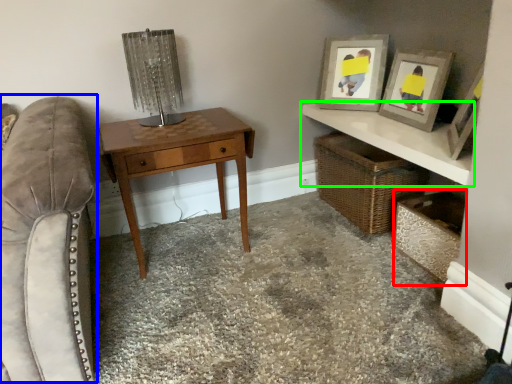
Question: Which is farther away from shelf (highlighted by a red box)? swivel chair (highlighted by a blue box) or shelf (highlighted by a green box)?

Choices:
 (A) swivel chair
 (B) shelf

Answer: (A)